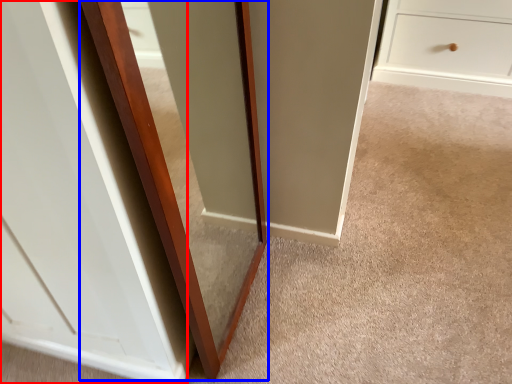
Question: Which of the following is the closest to the observer, glass door (highlighted by a red box) or glass door (highlighted by a blue box)?

Choices:
 (A) glass door
 (B) glass door

Answer: (A)